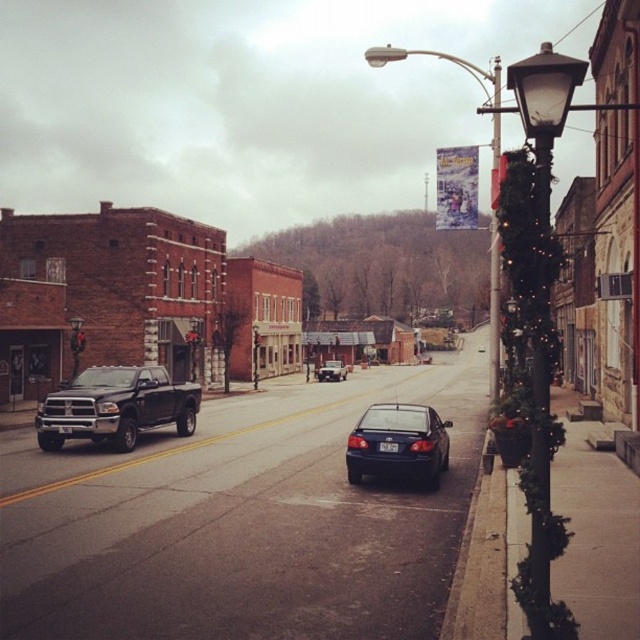
You are a delivery driver who needs to park your vehicle between the brown brick building at left and the shiny silver sedan at center. Given that your vehicle is 5 meters long, can you safely park there?

The brown brick building at left is larger in size than the shiny silver sedan at center, but the exact distance between them isn not provided. Without knowing the space available, it is impossible to determine if the 5 meter long vehicle can fit safely.

You are standing at the point labeled point (493, 100) and want to walk to the point labeled point (532, 618). Which direction should you move in to reach your destination?

You should move forward because point (532, 618) is in front of point (493, 100).

You are a pedestrian standing at the crosswalk and want to cross the street safely. You notice the matte black truck at left and the black plastic license plate at center. Which object is closer to the ground?

The matte black truck at left is closer to the ground because it is positioned below the black plastic license plate at center.